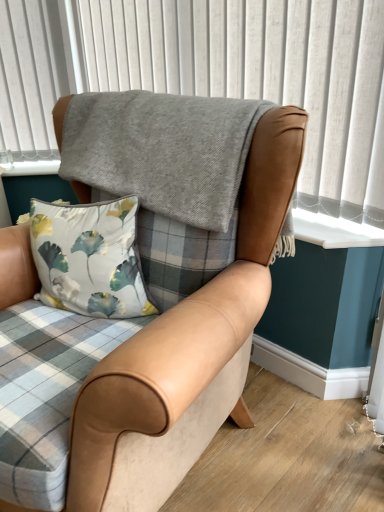
Question: From the image's perspective, is tan leather chair at center beneath gray woolen blanket at upper center?

Choices:
 (A) yes
 (B) no

Answer: (A)

Question: Is the depth of tan leather chair at center greater than that of gray woolen blanket at upper center?

Choices:
 (A) yes
 (B) no

Answer: (B)

Question: Does tan leather chair at center have a greater height compared to gray woolen blanket at upper center?

Choices:
 (A) no
 (B) yes

Answer: (B)

Question: From the image's perspective, is tan leather chair at center over gray woolen blanket at upper center?

Choices:
 (A) yes
 (B) no

Answer: (B)

Question: Does tan leather chair at center have a greater width compared to gray woolen blanket at upper center?

Choices:
 (A) no
 (B) yes

Answer: (B)

Question: From a real-world perspective, does tan leather chair at center stand above gray woolen blanket at upper center?

Choices:
 (A) no
 (B) yes

Answer: (A)

Question: Is gray woolen blanket at upper center far from tan leather chair at center?

Choices:
 (A) no
 (B) yes

Answer: (A)

Question: Can we say gray woolen blanket at upper center lies outside tan leather chair at center?

Choices:
 (A) no
 (B) yes

Answer: (B)

Question: Is gray woolen blanket at upper center at the right side of tan leather chair at center?

Choices:
 (A) no
 (B) yes

Answer: (B)

Question: From a real-world perspective, is gray woolen blanket at upper center located higher than tan leather chair at center?

Choices:
 (A) yes
 (B) no

Answer: (A)

Question: Can you confirm if gray woolen blanket at upper center is shorter than tan leather chair at center?

Choices:
 (A) no
 (B) yes

Answer: (B)

Question: Could you tell me if gray woolen blanket at upper center is turned towards tan leather chair at center?

Choices:
 (A) no
 (B) yes

Answer: (B)

Question: Is tan leather chair at center to the left or to the right of gray woolen blanket at upper center in the image?

Choices:
 (A) right
 (B) left

Answer: (B)